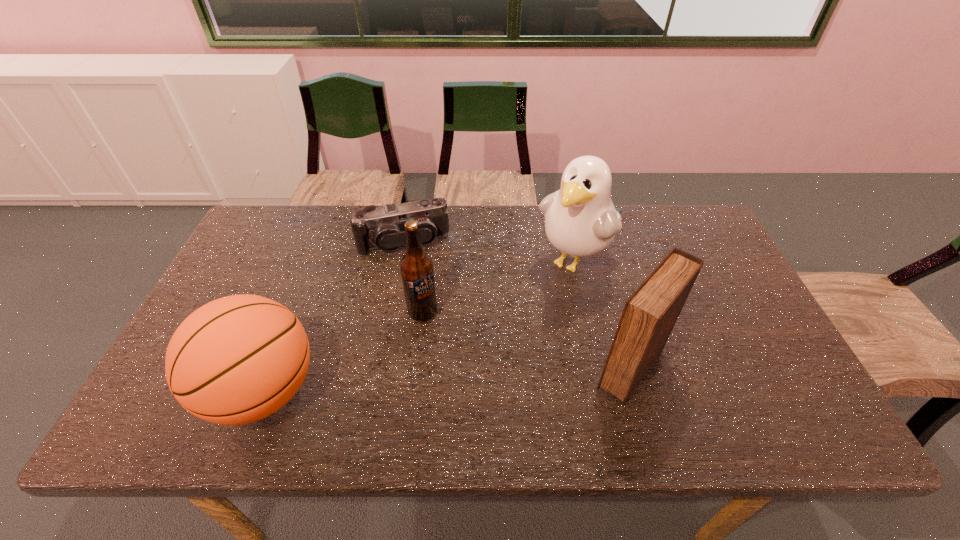
You are a GUI agent. You are given a task and a screenshot of the screen. Output one action in this format:
    pyautogui.click(x=<x>, y=<y>)
    Task: Click on the vacant spot on the desktop that is between the basketball and the Bible and is positioned on the front-facing side of the camcorder
    The image size is (960, 540).
    Given the screenshot: What is the action you would take?
    pyautogui.click(x=435, y=381)

Where is `free space on the desktop that is between the basketball and the Bible and is positioned on the beak of the tallest object`? The width and height of the screenshot is (960, 540). free space on the desktop that is between the basketball and the Bible and is positioned on the beak of the tallest object is located at coordinates (468, 379).

The height and width of the screenshot is (540, 960). In order to click on vacant spot on the desktop that is between the basketball and the Bible and is positioned on the label of the beer bottle in this screenshot , I will do `click(452, 380)`.